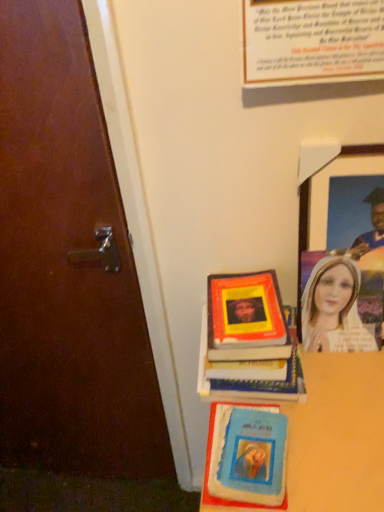
Identify the location of vacant area located to the right-hand side of blue matte book at lower center. (331, 433).